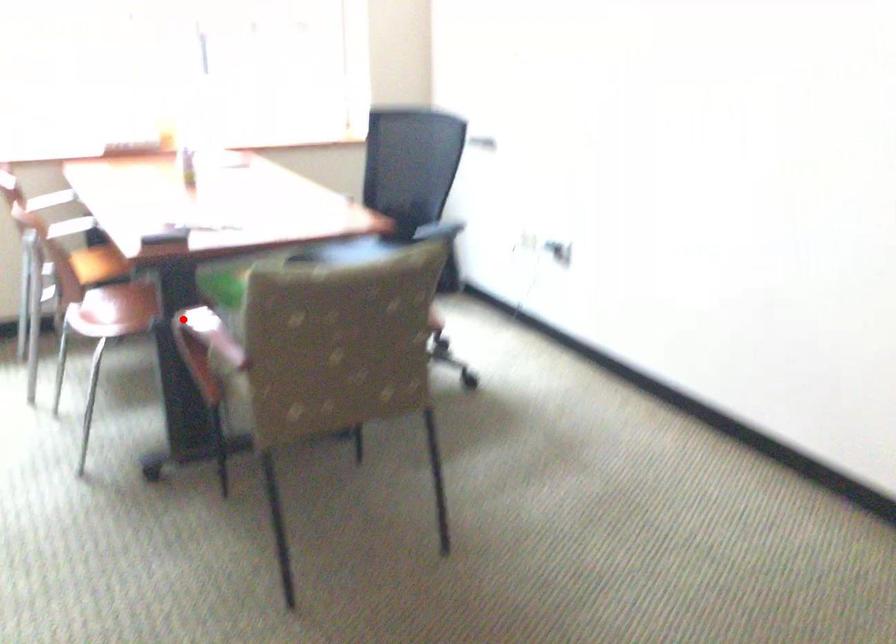
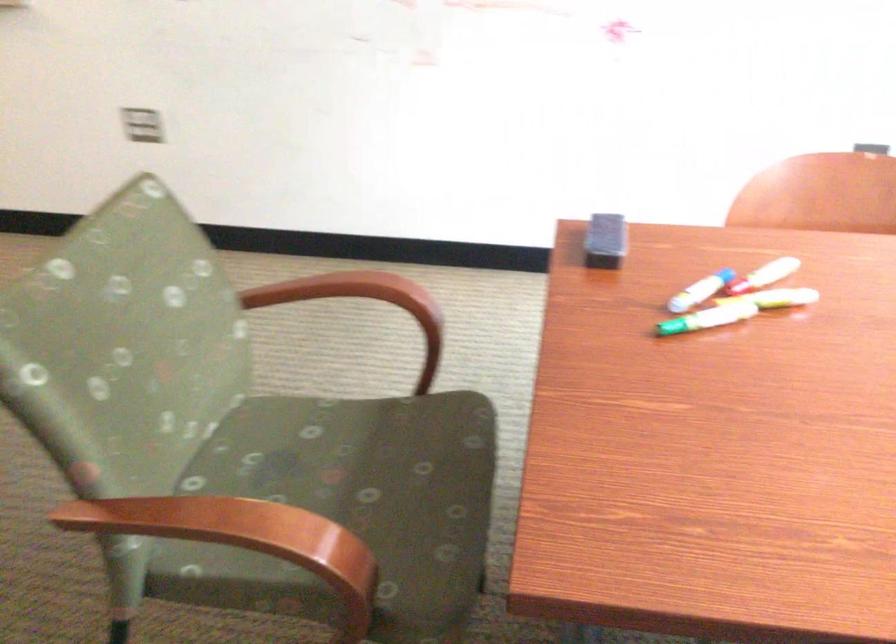
Question: I am providing you with two images of the same scene from different viewpoints. Given a red point in image1, look at the same physical point in image2. Is it:

Choices:
 (A) Closer to the viewpoint
 (B) Farther from the viewpoint

Answer: (A)